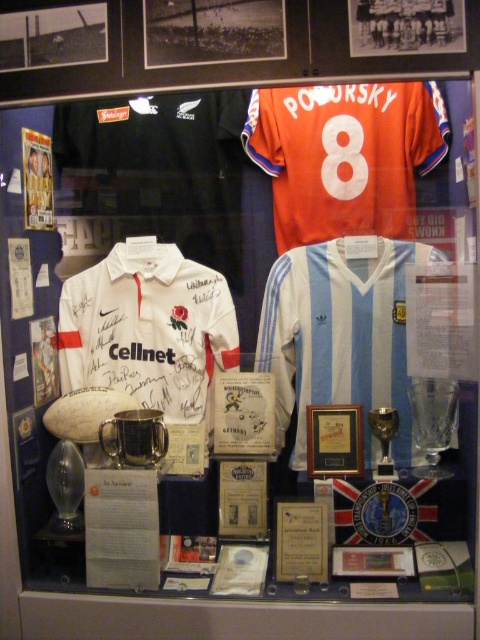
Is point (343, 288) positioned in front of point (407, 220)?

Yes.

Find the location of `white striped jersey at center`. white striped jersey at center is located at coordinates (340, 336).

Is point (354, 388) farther from camera compared to point (380, 196)?

No.

You are a GUI agent. You are given a task and a screenshot of the screen. Output one action in this format:
    pyautogui.click(x=<x>, y=<y>)
    Task: Click on the white striped jersey at center
    
    Given the screenshot: What is the action you would take?
    pyautogui.click(x=340, y=336)

Is point (443, 113) positioned behind point (192, 353)?

No, (443, 113) is closer to viewer.

Can you confirm if orange jersey at upper center is smaller than white matte jersey at center?

No.

Find the location of `orange jersey at upper center`. orange jersey at upper center is located at coordinates (345, 156).

Who is positioned more to the right, matte gold plaque at center or orange fabric number at upper center?

From the viewer's perspective, orange fabric number at upper center appears more on the right side.

Between point (276, 554) and point (331, 170), which one is positioned behind?

The point (331, 170) is behind.

Image resolution: width=480 pixels, height=640 pixels. In order to click on matte gold plaque at center in this screenshot , I will do `click(301, 541)`.

Locate an element on the screen. This screenshot has width=480, height=640. matte gold plaque at center is located at coordinates (301, 541).